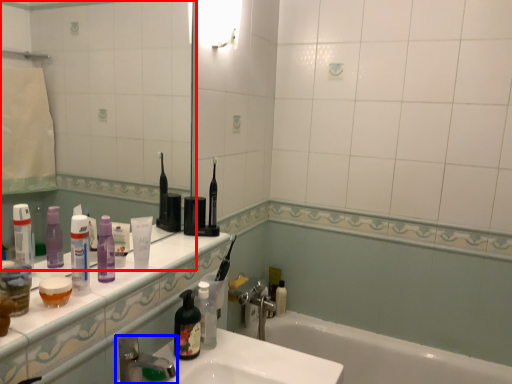
Question: Which of the following is the farthest to the observer, mirror (highlighted by a red box) or tap (highlighted by a blue box)?

Choices:
 (A) mirror
 (B) tap

Answer: (B)